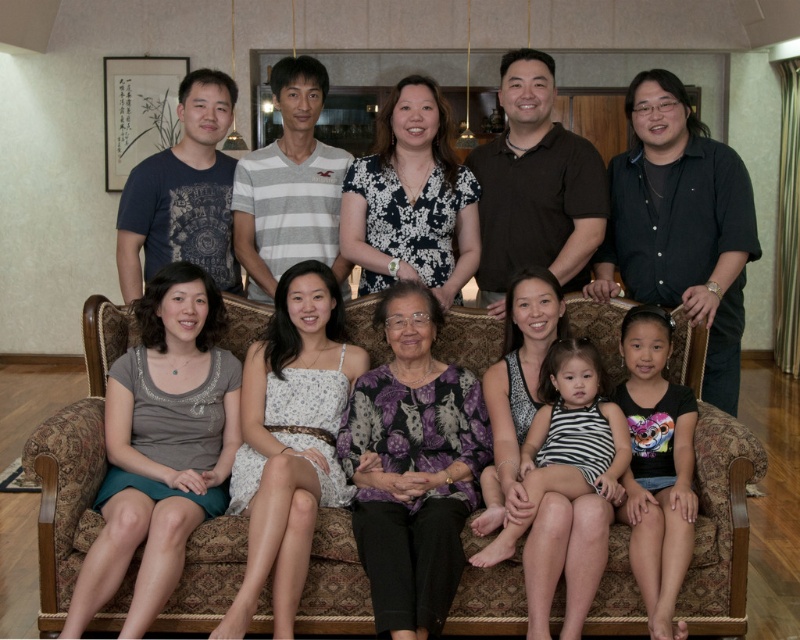
You are standing in the living area where the family photo was taken. You notice two points marked in the image. The first point is at coordinates point (68, 536) and the second is at point (238, 611). Which of these two points is closer to you?

Point (68, 536) is closer to you because it is further to the viewer than point (238, 611).

Looking at this image, you are a photographer setting up for a family photo. You need to ensure that the white floral dress at center is fully visible in the frame. Given that the patterned fabric couch at center is wider than the dress, where should you position the camera relative to the couch?

Since the patterned fabric couch at center is wider than the white floral dress at center, positioning the camera slightly to the side of the couch will allow the dress to remain fully visible in the frame while accommodating the couch width.